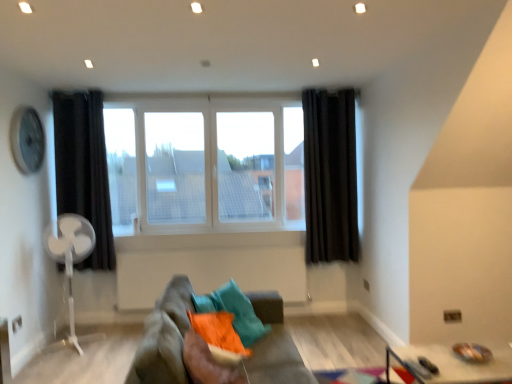
Image resolution: width=512 pixels, height=384 pixels. What do you see at coordinates (84, 169) in the screenshot?
I see `black fabric curtain at left, acting as the first curtain starting from the left` at bounding box center [84, 169].

Measure the distance between point (153,372) and camera.

Point (153,372) is 1.75 meters away from camera.

Locate an element on the screen. This screenshot has height=384, width=512. black fabric curtain at right, the 2th curtain when ordered from left to right is located at coordinates (330, 176).

Where is `metallic silver tray at lower right`? This screenshot has height=384, width=512. metallic silver tray at lower right is located at coordinates (453, 364).

Image resolution: width=512 pixels, height=384 pixels. What do you see at coordinates (453, 364) in the screenshot?
I see `metallic silver tray at lower right` at bounding box center [453, 364].

What do you see at coordinates (27, 140) in the screenshot? This screenshot has height=384, width=512. I see `metallic silver clock at upper left` at bounding box center [27, 140].

At what (x,y) coordinates should I click in order to perform the action: click on white glass window at center. Please return your answer as a coordinate pair (x, y). Looking at the image, I should click on (214, 165).

Where is `black fabric curtain at left, positioned as the second curtain in right-to-left order`? The height and width of the screenshot is (384, 512). black fabric curtain at left, positioned as the second curtain in right-to-left order is located at coordinates (84, 169).

You are a GUI agent. You are given a task and a screenshot of the screen. Output one action in this format:
    pyautogui.click(x=<x>, y=<y>)
    Task: Click on the window behind the black fabric curtain at left, positioned as the second curtain in right-to-left order
    
    Given the screenshot: What is the action you would take?
    pyautogui.click(x=214, y=165)

From the picture: Could you tell me if black fabric curtain at left, positioned as the second curtain in right-to-left order, is facing white glass window at center?

No, black fabric curtain at left, positioned as the second curtain in right-to-left order, is not turned towards white glass window at center.

Is black fabric curtain at left, acting as the first curtain starting from the left, wider than white glass window at center?

Yes.

From a real-world perspective, relative to black fabric curtain at left, positioned as the second curtain in right-to-left order, is white glass window at center vertically above or below?

In terms of real-world spatial position, white glass window at center is above black fabric curtain at left, positioned as the second curtain in right-to-left order.

Considering the relative sizes of white glass window at center and black fabric curtain at left, acting as the first curtain starting from the left, in the image provided, is white glass window at center shorter than black fabric curtain at left, acting as the first curtain starting from the left,?

Indeed, white glass window at center has a lesser height compared to black fabric curtain at left, acting as the first curtain starting from the left.

Does white glass window at center appear on the right side of black fabric curtain at left, acting as the first curtain starting from the left?

Correct, you'll find white glass window at center to the right of black fabric curtain at left, acting as the first curtain starting from the left.

In the image, is white glass window at center positioned in front of or behind black fabric curtain at left, positioned as the second curtain in right-to-left order?

In the image, white glass window at center appears behind black fabric curtain at left, positioned as the second curtain in right-to-left order.

Does white plastic fan at left appear on the left side of black fabric curtain at left, positioned as the second curtain in right-to-left order?

No.

Is point (77, 254) behind point (101, 151)?

No, (77, 254) is closer to viewer.

Is black fabric curtain at left, acting as the first curtain starting from the left, completely or partially inside white plastic fan at left?

No, white plastic fan at left does not contain black fabric curtain at left, acting as the first curtain starting from the left.

Is white plastic fan at left far from black fabric curtain at left, positioned as the second curtain in right-to-left order?

No, white plastic fan at left is not far away from black fabric curtain at left, positioned as the second curtain in right-to-left order.

Could you tell me if white glass window at center is turned towards textured fabric couch at center?

Yes, white glass window at center faces towards textured fabric couch at center.

Is white glass window at center bigger or smaller than textured fabric couch at center?

Considering their sizes, white glass window at center takes up less space than textured fabric couch at center.

Image resolution: width=512 pixels, height=384 pixels. Find the location of `studio couch below the white glass window at center (from a real-world perspective)`. studio couch below the white glass window at center (from a real-world perspective) is located at coordinates (165, 338).

From a real-world perspective, is white glass window at center located beneath textured fabric couch at center?

No, from a real-world perspective, white glass window at center is not under textured fabric couch at center.

Is white glass window at center at the back of textured fabric couch at center?

No, textured fabric couch at center is not facing away from white glass window at center.

From a real-world perspective, who is located higher, textured fabric couch at center or white glass window at center?

In real-world perspective, white glass window at center is above.

Can you confirm if textured fabric couch at center is wider than white glass window at center?

Yes.

Does point (175, 344) lie in front of point (250, 161)?

That is True.

From a real-world perspective, is metallic silver tray at lower right above or below textured fabric couch at center?

From a real-world perspective, metallic silver tray at lower right is physically below textured fabric couch at center.

Is metallic silver tray at lower right in front of or behind textured fabric couch at center in the image?

Visually, metallic silver tray at lower right is located behind textured fabric couch at center.

Does metallic silver tray at lower right have a lesser width compared to textured fabric couch at center?

Result: Yes.

Can you confirm if textured fabric couch at center is shorter than metallic silver tray at lower right?

No.

Which object is closer to the camera, textured fabric couch at center or metallic silver tray at lower right?

textured fabric couch at center is more forward.

Considering the relative sizes of textured fabric couch at center and metallic silver tray at lower right in the image provided, is textured fabric couch at center thinner than metallic silver tray at lower right?

Incorrect, the width of textured fabric couch at center is not less than that of metallic silver tray at lower right.

Measure the distance from textured fabric couch at center to metallic silver tray at lower right.

5.08 feet.

I want to click on window on the right of black fabric curtain at left, positioned as the second curtain in right-to-left order, so click(214, 165).

There is a white glass window at center. What are the coordinates of `the 2nd curtain below it (from the image's perspective)` in the screenshot? It's located at (84, 169).

From the image, which object appears to be nearer to white glass window at center, black fabric curtain at right, the 2th curtain when ordered from left to right, or black fabric curtain at left, acting as the first curtain starting from the left?

black fabric curtain at right, the 2th curtain when ordered from left to right.

Based on their spatial positions, is metallic silver tray at lower right or metallic silver clock at upper left further from white glass window at center?

Among the two, metallic silver tray at lower right is located further to white glass window at center.

Looking at the image, which one is located further to metallic silver clock at upper left, white glass window at center or white plastic fan at left?

white glass window at center is further to metallic silver clock at upper left.

Based on their spatial positions, is black fabric curtain at right, the 1th curtain in the right-to-left sequence, or textured fabric couch at center closer to metallic silver tray at lower right?

Among the two, textured fabric couch at center is located nearer to metallic silver tray at lower right.

From the image, which object appears to be nearer to metallic silver clock at upper left, white glass window at center or black fabric curtain at left, positioned as the second curtain in right-to-left order?

black fabric curtain at left, positioned as the second curtain in right-to-left order, lies closer to metallic silver clock at upper left than the other object.

Which object lies nearer to the anchor point white plastic fan at left, black fabric curtain at left, acting as the first curtain starting from the left, or metallic silver clock at upper left?

black fabric curtain at left, acting as the first curtain starting from the left.

Based on their spatial positions, is metallic silver tray at lower right or textured fabric couch at center further from white glass window at center?

metallic silver tray at lower right is further to white glass window at center.

When comparing their distances from black fabric curtain at left, positioned as the second curtain in right-to-left order, does black fabric curtain at right, the 1th curtain in the right-to-left sequence, or textured fabric couch at center seem further?

The object further to black fabric curtain at left, positioned as the second curtain in right-to-left order, is black fabric curtain at right, the 1th curtain in the right-to-left sequence.

Find the location of a particular element. The height and width of the screenshot is (384, 512). studio couch between metallic silver clock at upper left and metallic silver tray at lower right is located at coordinates (165, 338).

Identify the location of table between textured fabric couch at center and white glass window at center along the z-axis. The image size is (512, 384). (453, 364).

This screenshot has width=512, height=384. I want to click on fan positioned between textured fabric couch at center and black fabric curtain at right, the 1th curtain in the right-to-left sequence, from near to far, so click(x=70, y=260).

In order to click on window located between black fabric curtain at left, acting as the first curtain starting from the left, and black fabric curtain at right, the 2th curtain when ordered from left to right, in the left-right direction in this screenshot , I will do `click(214, 165)`.